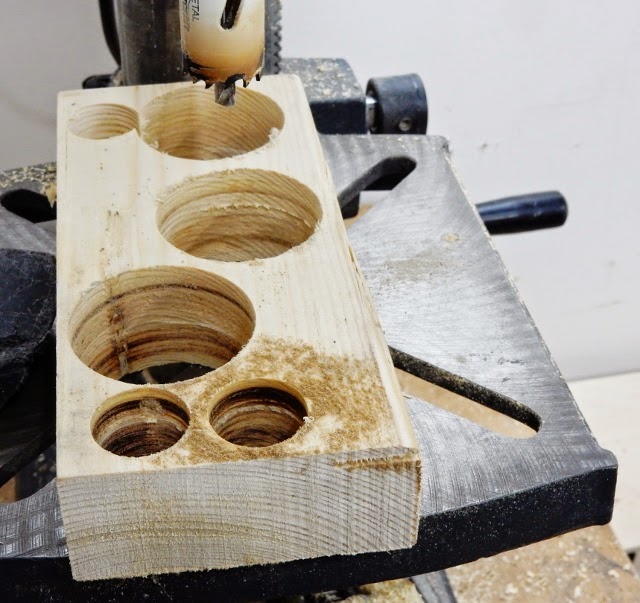
Where is `handle`? The image size is (640, 603). handle is located at coordinates (518, 210).